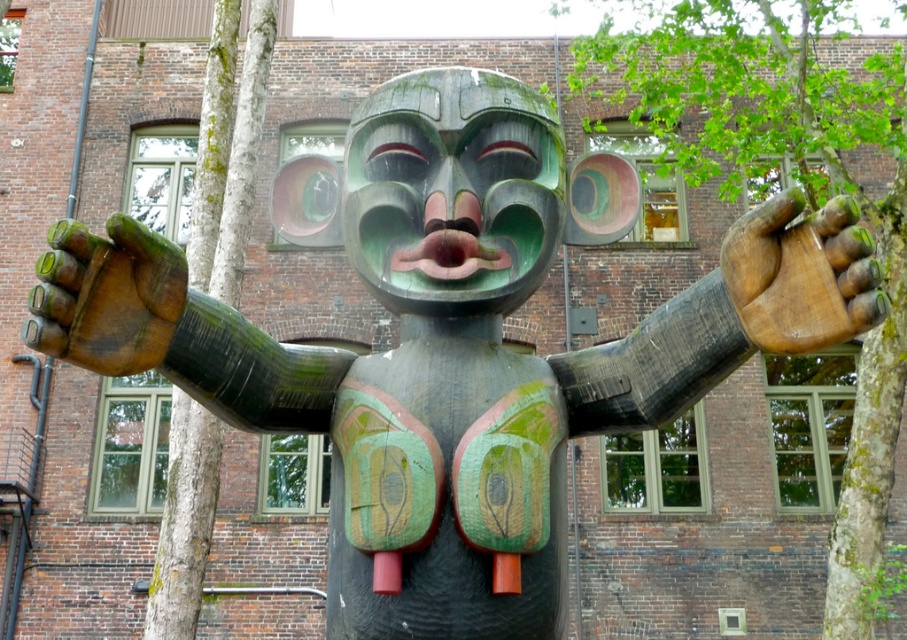
Does green mossy tree trunk at center have a lesser height compared to metallic pipe at left?

No, green mossy tree trunk at center is not shorter than metallic pipe at left.

Does green mossy tree trunk at center appear on the right side of metallic pipe at left?

Indeed, green mossy tree trunk at center is positioned on the right side of metallic pipe at left.

You are a GUI agent. You are given a task and a screenshot of the screen. Output one action in this format:
    pyautogui.click(x=<x>, y=<y>)
    Task: Click on the green mossy tree trunk at center
    The height and width of the screenshot is (640, 907).
    Given the screenshot: What is the action you would take?
    pyautogui.click(x=776, y=186)

This screenshot has height=640, width=907. In order to click on green mossy tree trunk at center in this screenshot , I will do `click(776, 186)`.

Describe the element at coordinates (228, 150) in the screenshot. I see `green rough bark tree at left` at that location.

Who is more distant from viewer, (180, 477) or (81, 131)?

The point (81, 131) is behind.

Locate an element on the screen. This screenshot has width=907, height=640. green rough bark tree at left is located at coordinates (228, 150).

Between point (788, 74) and point (174, 502), which one is positioned behind?

Point (788, 74)

Which is in front, point (679, 29) or point (189, 614)?

Point (189, 614) is more forward.

Locate an element on the screen. This screenshot has height=640, width=907. green mossy tree trunk at center is located at coordinates (776, 186).